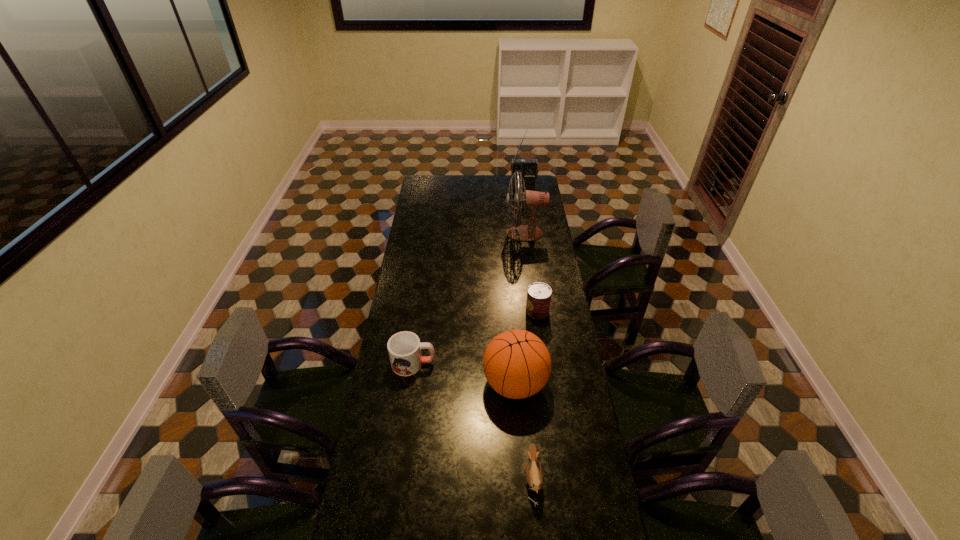
Find the location of a particular element. free point that satisfies the following two spatial constraints: 1. on the back side of the third tallest object; 2. on the side of the mug with the handle is located at coordinates (514, 363).

In order to click on free spot that satisfies the following two spatial constraints: 1. on the display of the radio receiver; 2. at the beak of the nearest object in this screenshot , I will do `click(564, 479)`.

Locate an element on the screen. free space that satisfies the following two spatial constraints: 1. in front of the third farthest object to direct airflow; 2. on the right side of the fifth nearest object is located at coordinates (535, 311).